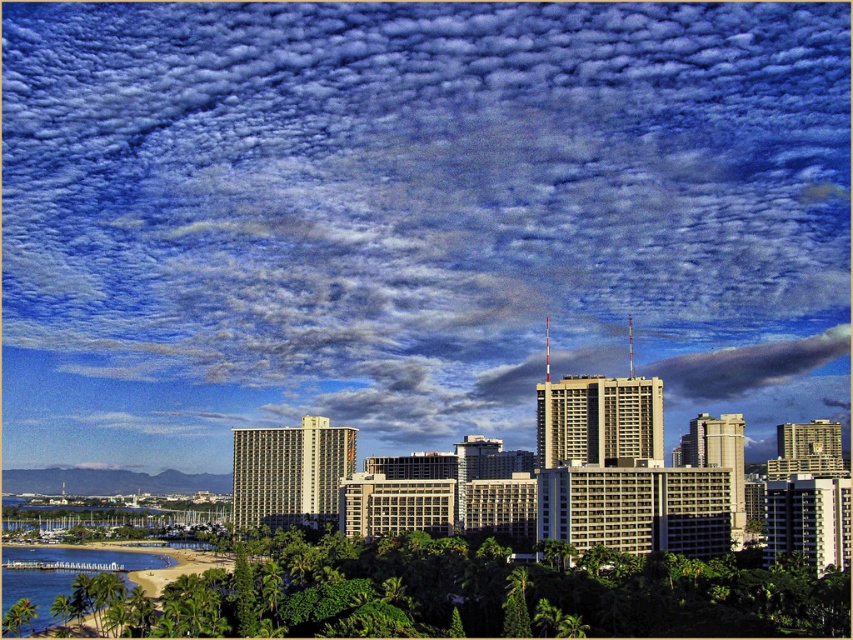
You are an architect analyzing the cityscape. You need to determine the exact position of the cloudy sky at upper center in the image. What are its coordinates?

The cloudy sky at upper center is located at coordinates (428, 200).

You are an architect designing a new observation deck that needs to have a clear view of both the cloudy sky at upper center and the clear blue water at lower left. Based on the scene, which object occupies a larger horizontal space in the image?

The cloudy sky at upper center might be wider than clear blue water at lower left, so the cloudy sky at upper center likely occupies a larger horizontal space in the image.